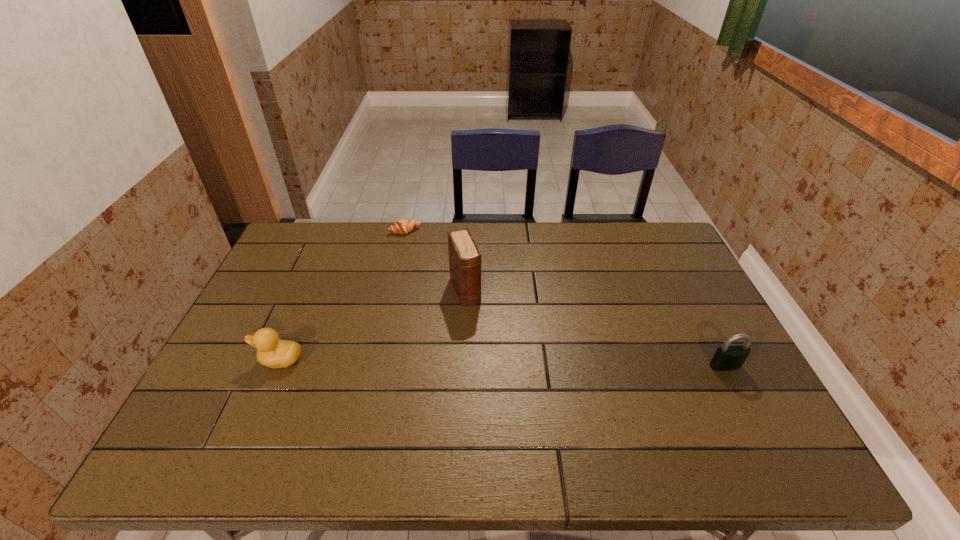
Where is `vacant space that is in between the shortest object and the leftmost object`? vacant space that is in between the shortest object and the leftmost object is located at coordinates (343, 295).

I want to click on blank region between the pastry and the padlock, so click(564, 299).

I want to click on vacant space that is in between the padlock and the tallest object, so click(x=595, y=328).

This screenshot has height=540, width=960. In order to click on free space between the third object from left to right and the duckling in this screenshot , I will do `click(372, 325)`.

Identify the location of vacant space that is in between the padlock and the diary. (595, 328).

Where is `object that ranks as the second closest to the padlock`? Image resolution: width=960 pixels, height=540 pixels. object that ranks as the second closest to the padlock is located at coordinates (402, 226).

Identify which object is the second closest to the duckling. Please provide its 2D coordinates. Your answer should be formatted as a tuple, i.e. [(x, y)], where the tuple contains the x and y coordinates of a point satisfying the conditions above.

[(402, 226)]

Identify the location of vacant area that satisfies the following two spatial constraints: 1. on the front side of the second farthest object; 2. on the left side of the farthest object. The width and height of the screenshot is (960, 540). coord(392,290).

The image size is (960, 540). Identify the location of vacant point that satisfies the following two spatial constraints: 1. on the front side of the padlock; 2. on the left side of the farthest object. (374, 366).